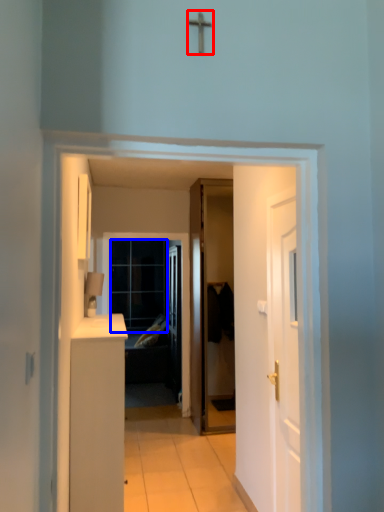
Question: Which of the following is the closest to the observer, crucifix (highlighted by a red box) or glass door (highlighted by a blue box)?

Choices:
 (A) crucifix
 (B) glass door

Answer: (A)